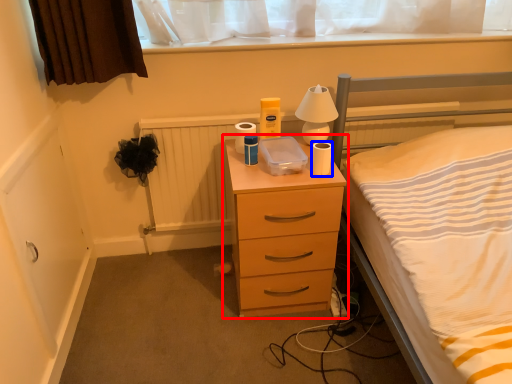
Question: Which object is further to the camera taking this photo, chest of drawers (highlighted by a red box) or toilet paper (highlighted by a blue box)?

Choices:
 (A) chest of drawers
 (B) toilet paper

Answer: (B)